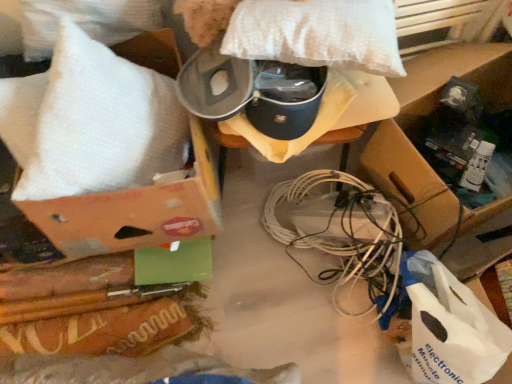
Question: From a real-world perspective, is white plastic bag at lower right physically located above or below brown cardboard box at lower right?

Choices:
 (A) above
 (B) below

Answer: (B)

Question: Is white plastic bag at lower right to the left or to the right of brown cardboard box at lower right in the image?

Choices:
 (A) right
 (B) left

Answer: (B)

Question: Which object is the closest to the white plastic wire at center?

Choices:
 (A) white bubble wrap at upper left, marked as the first pillow in a left-to-right arrangement
 (B) white dotted pillow at upper center, which is the 2th pillow in left-to-right order
 (C) brown cardboard box at lower right
 (D) white plastic bag at lower right

Answer: (D)

Question: Considering the real-world distances, which object is farthest from the brown cardboard box at lower right?

Choices:
 (A) white bubble wrap at upper left, marked as the first pillow in a left-to-right arrangement
 (B) white plastic wire at center
 (C) white dotted pillow at upper center, which is the 2th pillow in left-to-right order
 (D) white plastic bag at lower right

Answer: (A)